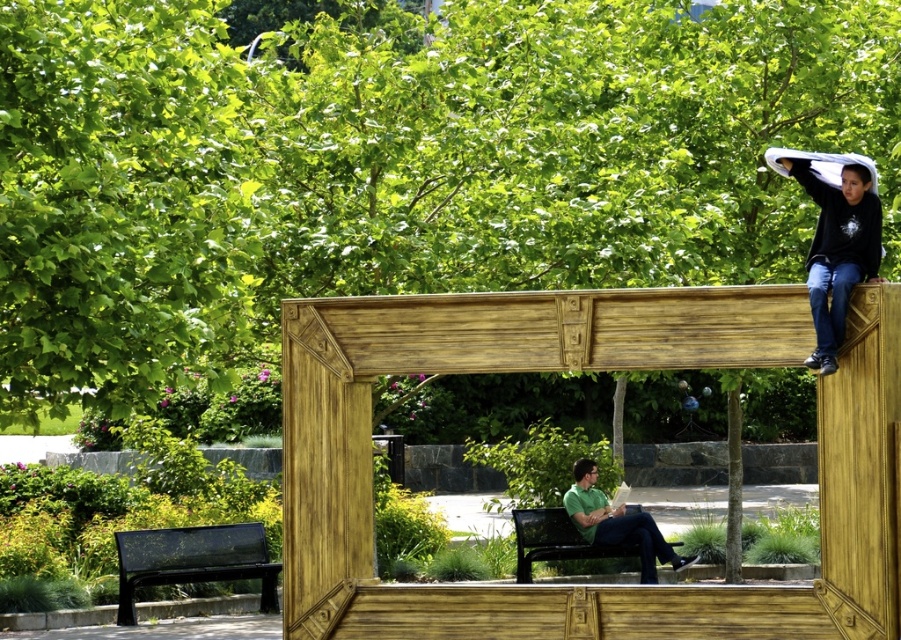
Looking at this image, between wooden pergola at upper center and black metal bench at lower center, which one has less height?

With less height is wooden pergola at upper center.

How much distance is there between wooden pergola at upper center and black metal bench at lower center?

The distance of wooden pergola at upper center from black metal bench at lower center is 42.57 feet.

Who is more distant from viewer, (x=771, y=310) or (x=516, y=516)?

Positioned behind is point (x=516, y=516).

I want to click on wooden pergola at upper center, so click(x=592, y=369).

Is green leafy tree at upper center smaller than black metal bench at lower left?

Incorrect, green leafy tree at upper center is not smaller in size than black metal bench at lower left.

Is point (117, 387) farther from camera compared to point (126, 589)?

No, it is in front of (126, 589).

Where is `green leafy tree at upper center`? The image size is (901, 640). green leafy tree at upper center is located at coordinates (397, 163).

The height and width of the screenshot is (640, 901). What do you see at coordinates (397, 163) in the screenshot? I see `green leafy tree at upper center` at bounding box center [397, 163].

Is green leafy tree at upper center behind green matte shirt at lower center?

No, green leafy tree at upper center is in front of green matte shirt at lower center.

Which is behind, point (146, 400) or point (576, 524)?

Positioned behind is point (576, 524).

What are the coordinates of `green leafy tree at upper center` in the screenshot? It's located at pyautogui.click(x=397, y=163).